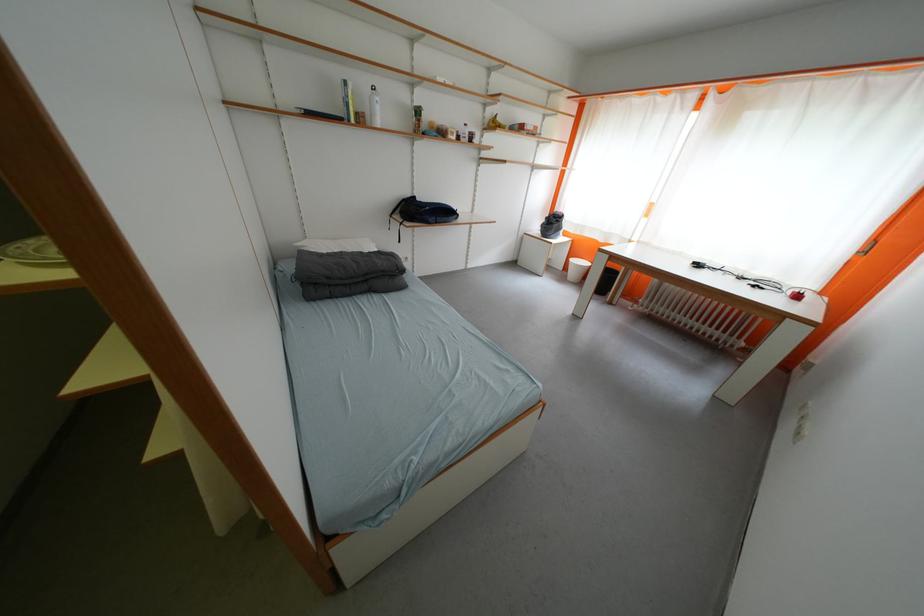
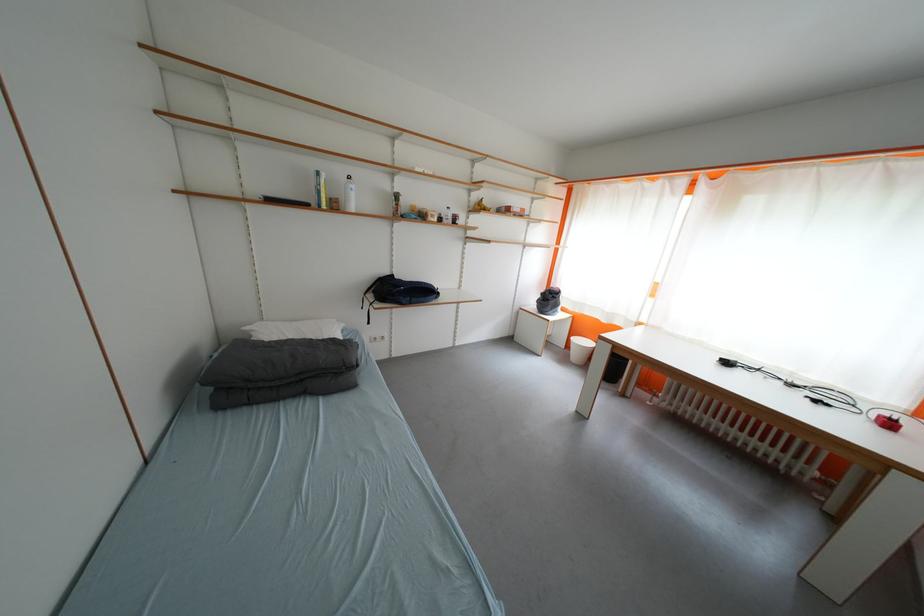
Find the pixel in the second image that matches pixel 308 246 in the first image.

(257, 331)